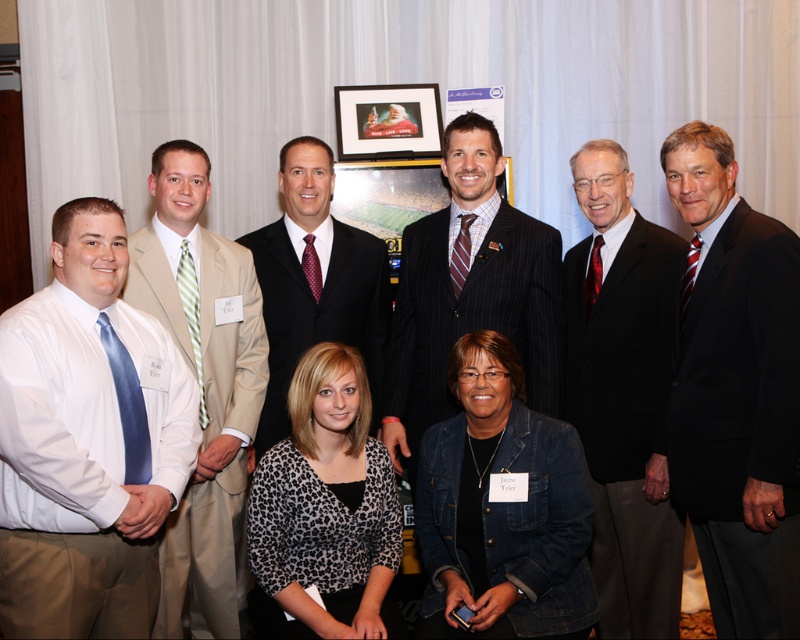
Can you confirm if black pinstripe suit at right is positioned below beige suit at left?

Incorrect, black pinstripe suit at right is not positioned below beige suit at left.

Which of these two, black pinstripe suit at right or beige suit at left, stands taller?

With more height is beige suit at left.

Image resolution: width=800 pixels, height=640 pixels. Describe the element at coordinates (624, 394) in the screenshot. I see `black pinstripe suit at right` at that location.

Locate an element on the screen. black pinstripe suit at right is located at coordinates (624, 394).

Is dark blue suit at center shorter than leopard print blouse at center?

No.

Between point (730, 545) and point (325, 611), which one is positioned in front?

Point (730, 545) is in front.

At what (x,y) coordinates should I click in order to perform the action: click on dark blue suit at center. Please return your answer as a coordinate pair (x, y). Looking at the image, I should click on (736, 390).

Is striped tie at center thinner than matte black picture frame at upper center?

No.

Is the position of striped tie at center more distant than that of matte black picture frame at upper center?

That is False.

What do you see at coordinates (470, 291) in the screenshot? I see `striped tie at center` at bounding box center [470, 291].

The image size is (800, 640). I want to click on striped tie at center, so click(470, 291).